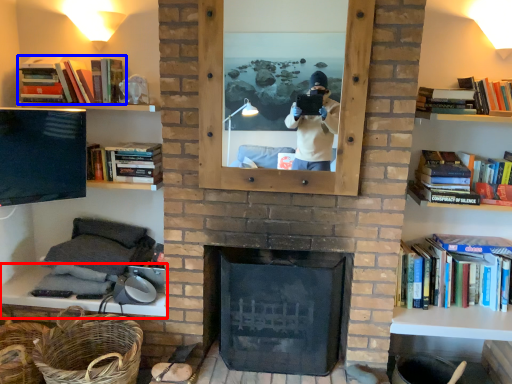
Question: Which object is closer to the camera taking this photo, mantle (highlighted by a red box) or book (highlighted by a blue box)?

Choices:
 (A) mantle
 (B) book

Answer: (A)